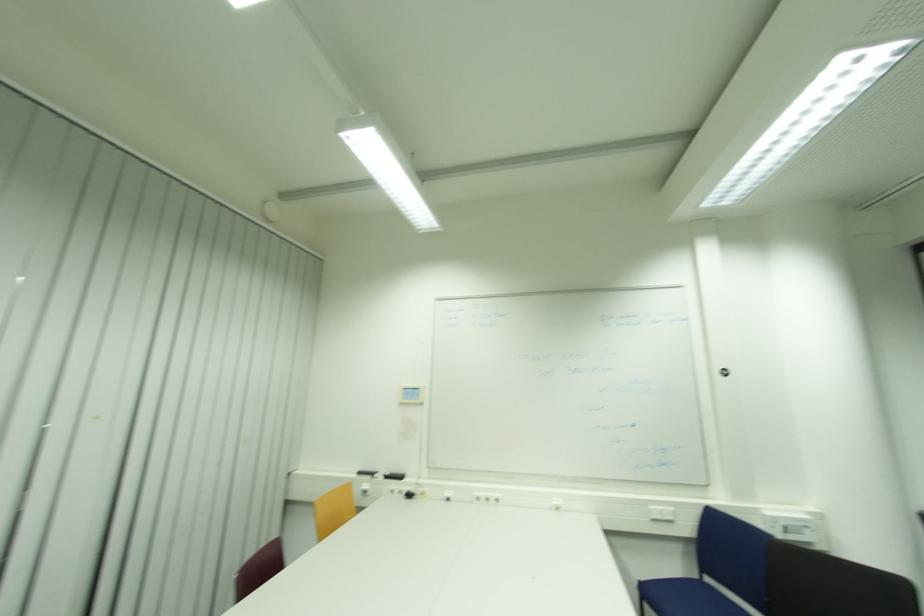
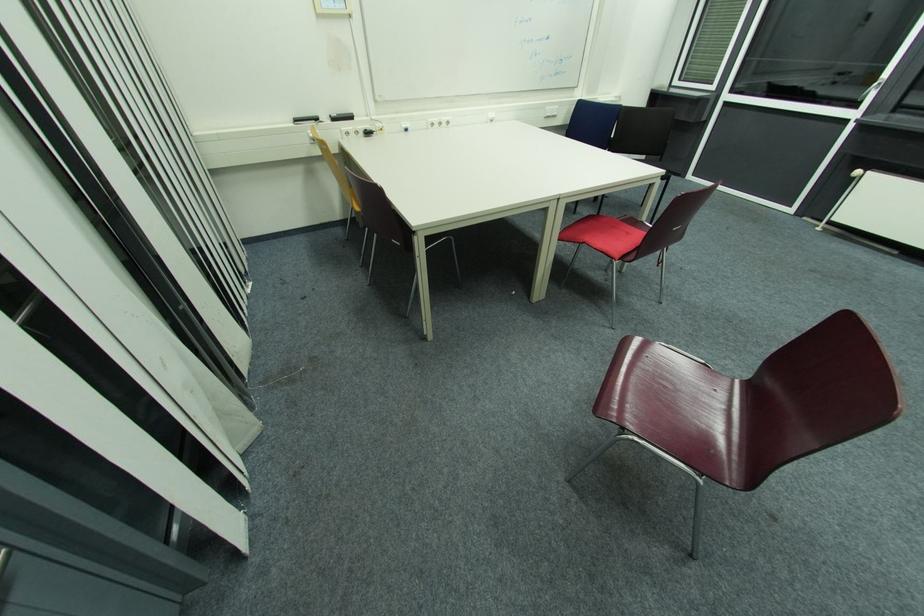
Locate, in the second image, the point that corresponds to pixel 390 477 in the first image.

(337, 121)